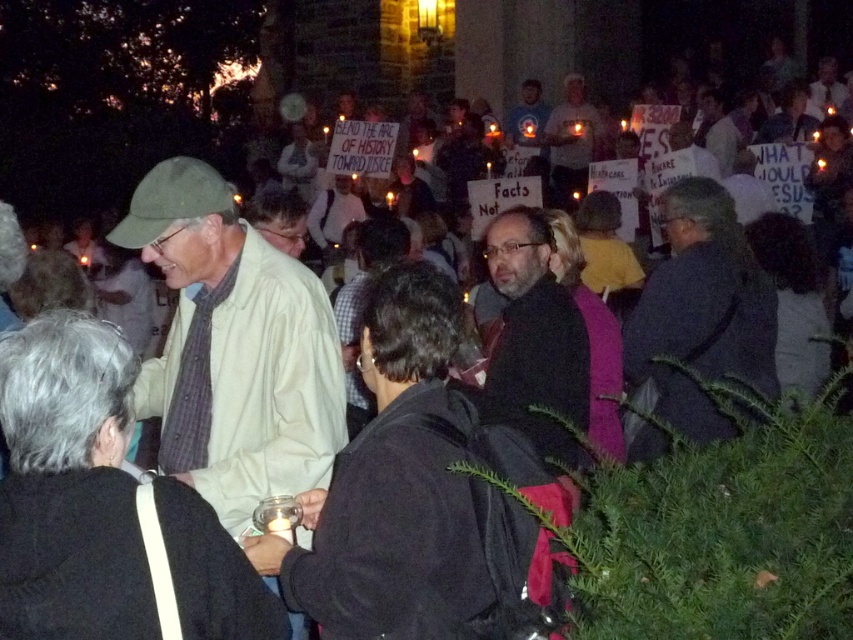
Question: Can you confirm if light beige shirt at center is positioned below dark gray jacket at center?

Choices:
 (A) yes
 (B) no

Answer: (A)

Question: Where is light beige shirt at center located in relation to white shirt at center in the image?

Choices:
 (A) above
 (B) below

Answer: (B)

Question: Based on their relative distances, which object is farther from the light beige shirt at center?

Choices:
 (A) dark gray jacket at center
 (B) white shirt at center

Answer: (B)

Question: Which point appears closest to the camera in this image?

Choices:
 (A) (239, 292)
 (B) (596, 129)

Answer: (A)

Question: Which object is the farthest from the white shirt at center?

Choices:
 (A) light beige shirt at center
 (B) dark gray jacket at center

Answer: (A)

Question: Is light beige shirt at center bigger than dark brown leather jacket at center?

Choices:
 (A) yes
 (B) no

Answer: (A)